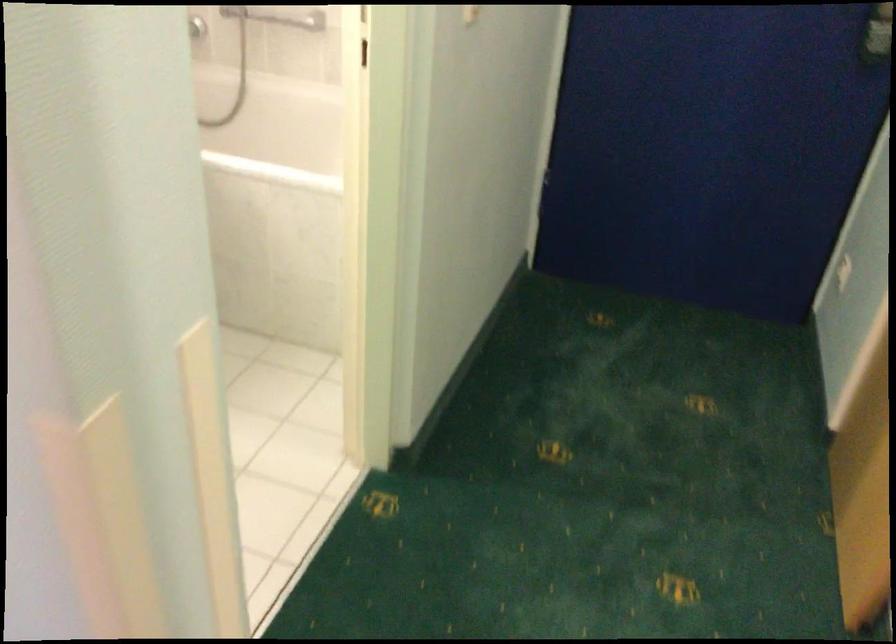
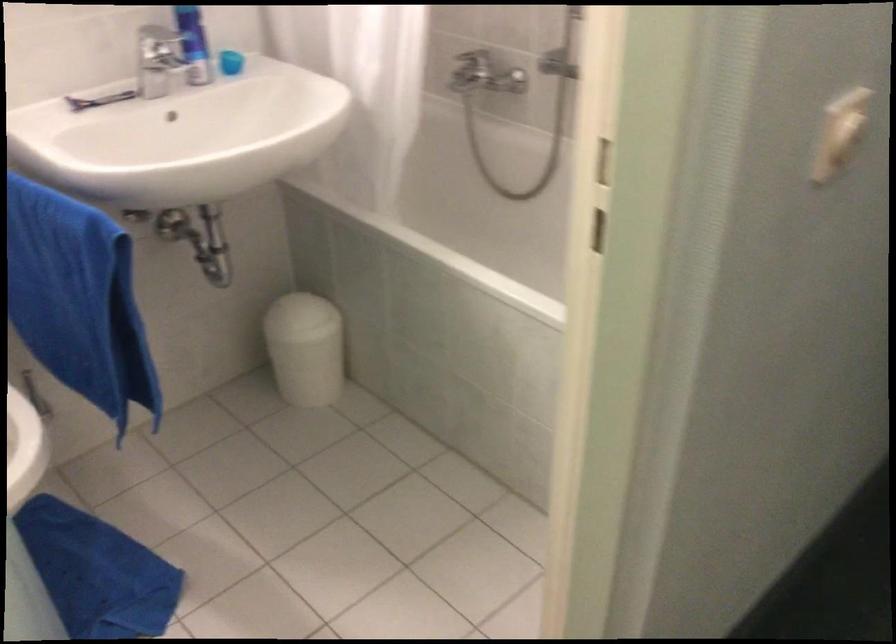
Question: Which direction would the cameraman need to move to produce the second image? Reply with the corresponding letter.

Choices:
 (A) Left
 (B) Right
 (C) Forward
 (D) Backward

Answer: (C)